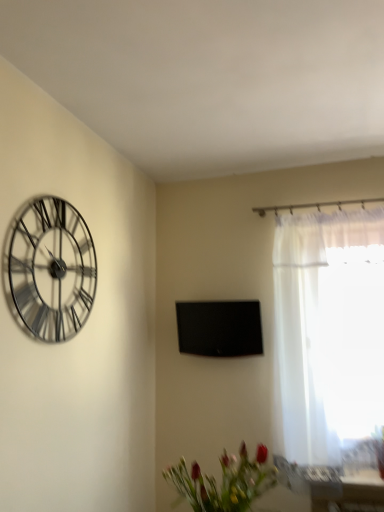
Question: Does black glossy tv at center appear on the left side of matte green vase at lower center?

Choices:
 (A) no
 (B) yes

Answer: (A)

Question: Is black glossy tv at center positioned before matte green vase at lower center?

Choices:
 (A) yes
 (B) no

Answer: (B)

Question: Does black glossy tv at center have a greater height compared to matte green vase at lower center?

Choices:
 (A) yes
 (B) no

Answer: (A)

Question: Is there a large distance between black glossy tv at center and matte green vase at lower center?

Choices:
 (A) no
 (B) yes

Answer: (A)

Question: Can you confirm if black glossy tv at center is shorter than matte green vase at lower center?

Choices:
 (A) yes
 (B) no

Answer: (B)

Question: Can you confirm if black glossy tv at center is bigger than matte green vase at lower center?

Choices:
 (A) no
 (B) yes

Answer: (A)

Question: Considering the relative sizes of white sheer curtain at right and black glossy tv at center in the image provided, is white sheer curtain at right taller than black glossy tv at center?

Choices:
 (A) yes
 (B) no

Answer: (A)

Question: Does white sheer curtain at right appear on the right side of black glossy tv at center?

Choices:
 (A) no
 (B) yes

Answer: (B)

Question: Can you confirm if white sheer curtain at right is shorter than black glossy tv at center?

Choices:
 (A) yes
 (B) no

Answer: (B)

Question: Can you confirm if white sheer curtain at right is wider than black glossy tv at center?

Choices:
 (A) no
 (B) yes

Answer: (B)

Question: Is black glossy tv at center at the back of white sheer curtain at right?

Choices:
 (A) yes
 (B) no

Answer: (B)

Question: Can you confirm if white sheer curtain at right is smaller than black glossy tv at center?

Choices:
 (A) no
 (B) yes

Answer: (A)

Question: Is metallic silver clock at upper left to the right of black glossy tv at center from the viewer's perspective?

Choices:
 (A) no
 (B) yes

Answer: (A)